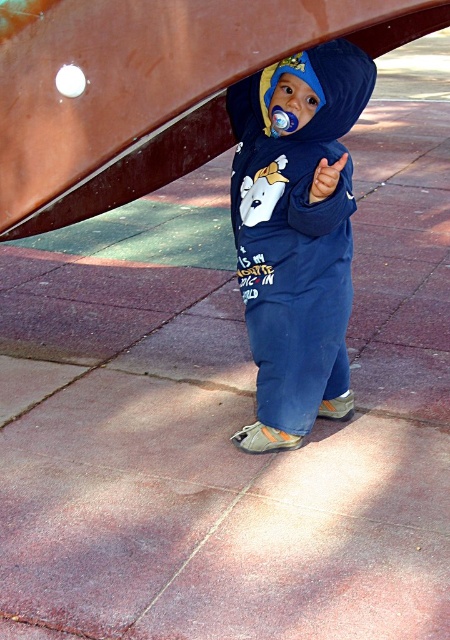
Is navy blue fleece onesie at center thinner than rubber teething ring at center?

Incorrect, navy blue fleece onesie at center's width is not less than rubber teething ring at center's.

Between point (286, 196) and point (315, 188), which one is positioned behind?

Positioned behind is point (286, 196).

The image size is (450, 640). Find the location of `navy blue fleece onesie at center`. navy blue fleece onesie at center is located at coordinates (297, 234).